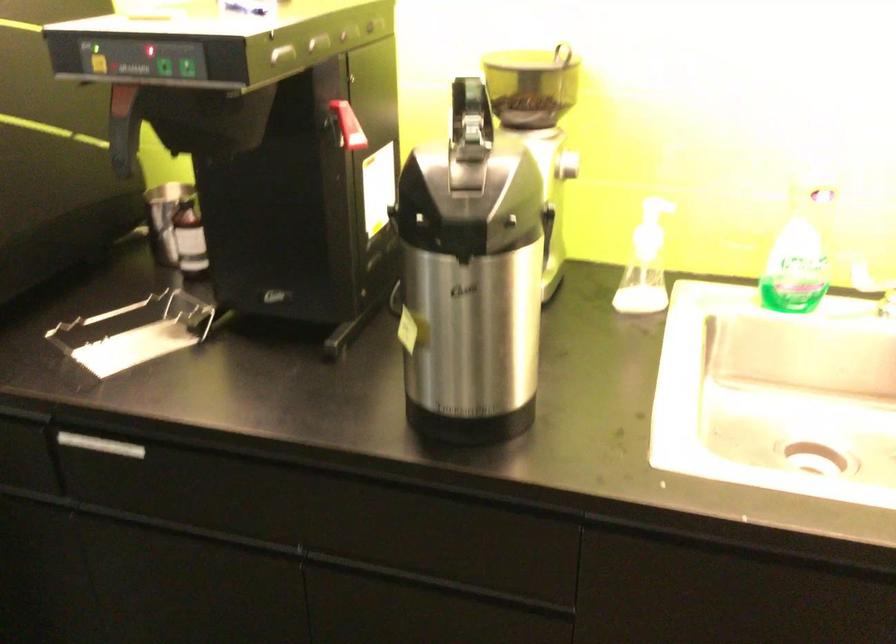
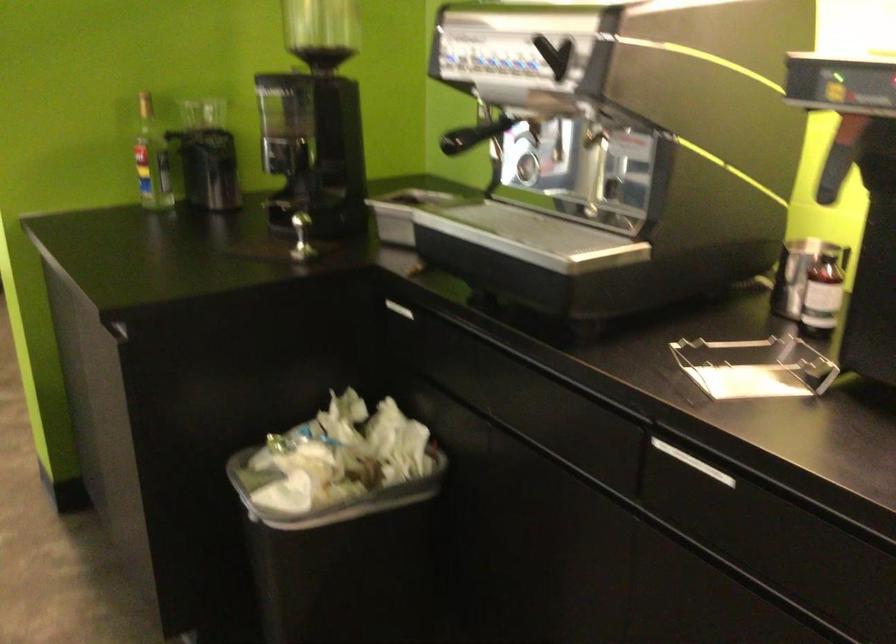
Locate, in the second image, the point that corresponds to (195,242) in the first image.

(822, 294)